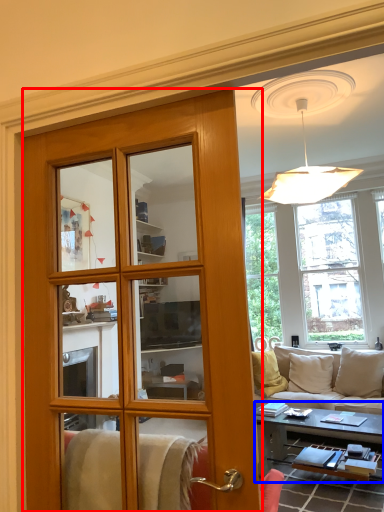
Question: Which of the following is the farthest to the observer, door (highlighted by a red box) or table (highlighted by a blue box)?

Choices:
 (A) door
 (B) table

Answer: (B)